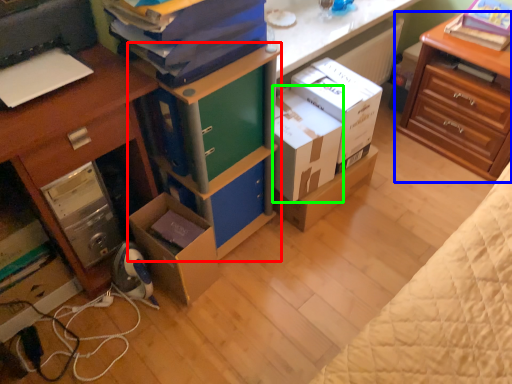
Question: Estimate the real-world distances between objects in this image. Which object is closer to bookshelf (highlighted by a red box), nightstand (highlighted by a blue box) or box (highlighted by a green box)?

Choices:
 (A) nightstand
 (B) box

Answer: (B)